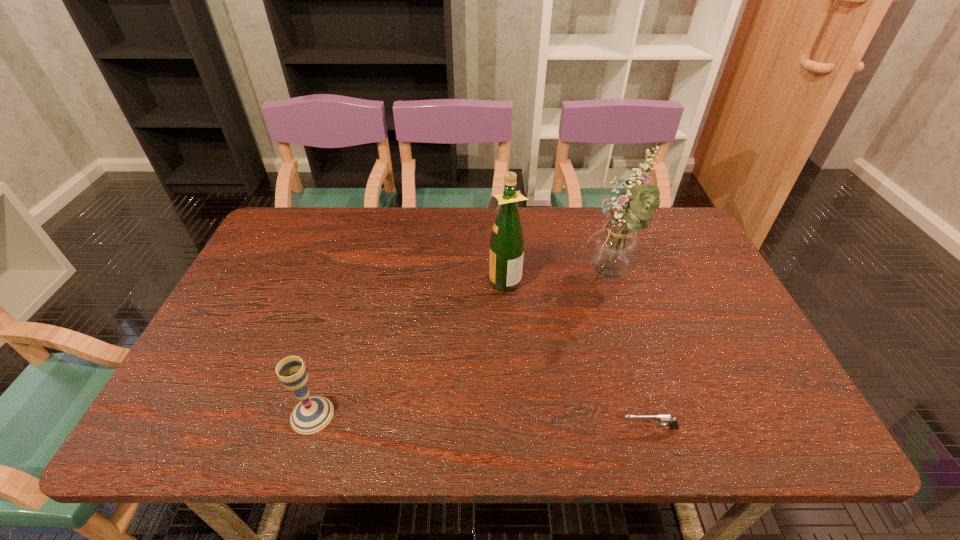
Identify the location of free location located 0.280m on the front-facing side of the liquor. This screenshot has width=960, height=540. (387, 279).

Locate an element on the screen. free space located 0.260m on the front-facing side of the liquor is located at coordinates (394, 279).

The height and width of the screenshot is (540, 960). I want to click on vacant region located 0.250m on the right of the leftmost object, so click(x=451, y=415).

Image resolution: width=960 pixels, height=540 pixels. Identify the location of vacant space positioned 0.250m on the front-facing side of the pistol. (499, 428).

Where is `free space located 0.300m on the front-facing side of the pistol`? This screenshot has height=540, width=960. free space located 0.300m on the front-facing side of the pistol is located at coordinates (475, 428).

The width and height of the screenshot is (960, 540). In order to click on free space located on the front-facing side of the pistol in this screenshot , I will do `click(591, 428)`.

Where is `object situated at the far edge`? Image resolution: width=960 pixels, height=540 pixels. object situated at the far edge is located at coordinates (615, 247).

What are the coordinates of `chalice that is at the near edge` in the screenshot? It's located at (312, 414).

This screenshot has height=540, width=960. I want to click on pistol at the near edge, so click(662, 419).

You are a GUI agent. You are given a task and a screenshot of the screen. Output one action in this format:
    pyautogui.click(x=<x>, y=<y>)
    Task: Click on the free space at the far edge of the desktop
    This screenshot has width=960, height=540.
    Given the screenshot: What is the action you would take?
    pyautogui.click(x=428, y=215)